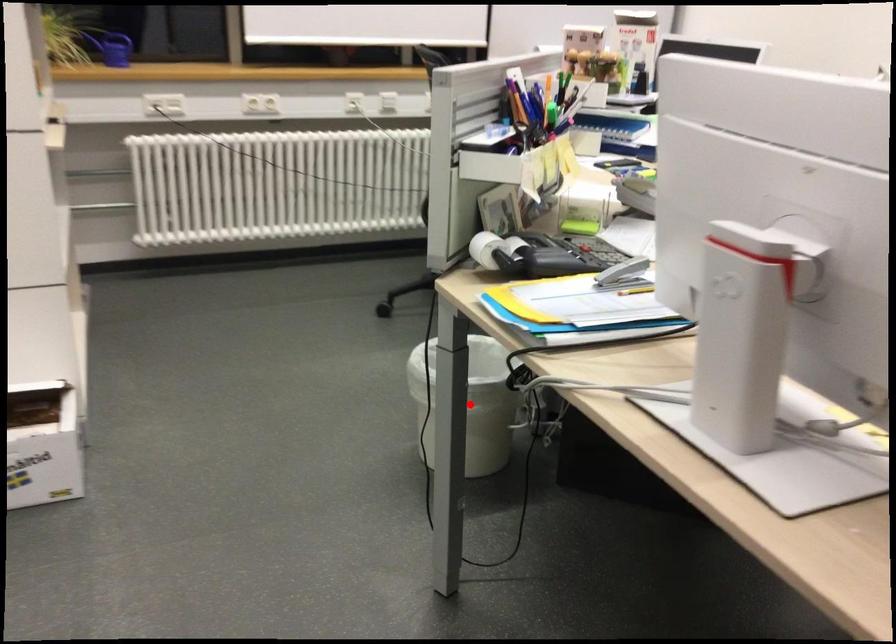
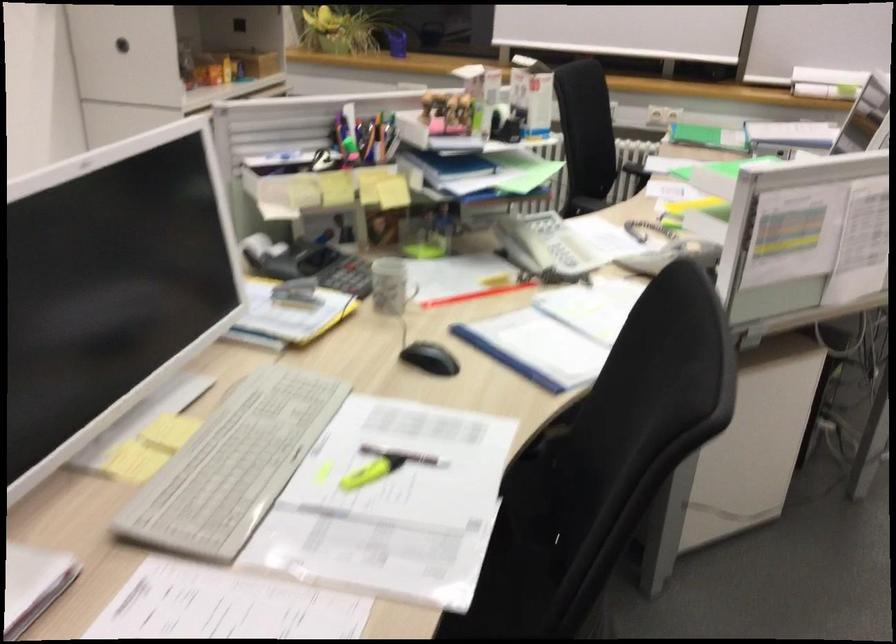
Question: I am providing you with two images of the same scene from different viewpoints. A red point is marked on the first image. Is the red point's position out of view in image 2?

Choices:
 (A) Yes
 (B) No

Answer: (A)